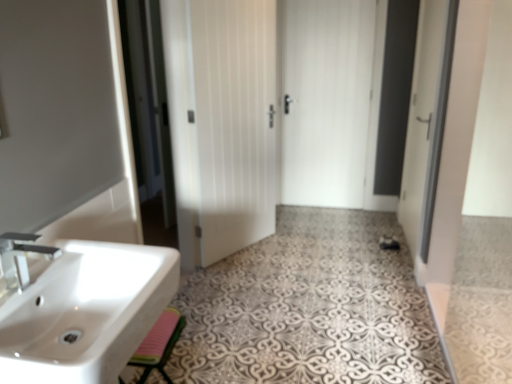
Question: From a real-world perspective, is white matte door at center, which is the second door from right to left, physically below matte silver faucet at left?

Choices:
 (A) no
 (B) yes

Answer: (B)

Question: Is white matte door at center, which is the second door from right to left, positioned beyond the bounds of matte silver faucet at left?

Choices:
 (A) yes
 (B) no

Answer: (A)

Question: Does white matte door at center, which is the second door from right to left, have a larger size compared to matte silver faucet at left?

Choices:
 (A) yes
 (B) no

Answer: (A)

Question: Is white matte door at center, positioned as the 1th door in left-to-right order, directly adjacent to matte silver faucet at left?

Choices:
 (A) yes
 (B) no

Answer: (B)

Question: From the image's perspective, is white matte door at center, positioned as the 1th door in left-to-right order, on matte silver faucet at left?

Choices:
 (A) no
 (B) yes

Answer: (B)

Question: In the image, is white matte door at center, marked as the first door in a front-to-back arrangement, positioned in front of or behind pink rubber mat at lower left?

Choices:
 (A) front
 (B) behind

Answer: (B)

Question: From their relative heights in the image, would you say white matte door at center, which is the second door from right to left, is taller or shorter than pink rubber mat at lower left?

Choices:
 (A) tall
 (B) short

Answer: (A)

Question: Would you say white matte door at center, positioned as the 1th door in left-to-right order, is inside or outside pink rubber mat at lower left?

Choices:
 (A) inside
 (B) outside

Answer: (B)

Question: Is white matte door at center, positioned as the 1th door in left-to-right order, bigger or smaller than pink rubber mat at lower left?

Choices:
 (A) big
 (B) small

Answer: (A)

Question: Considering the positions of white glossy towel at lower left and white glossy sink at lower left in the image, is white glossy towel at lower left taller or shorter than white glossy sink at lower left?

Choices:
 (A) tall
 (B) short

Answer: (B)

Question: Is point (300, 299) closer or farther from the camera than point (89, 370)?

Choices:
 (A) closer
 (B) farther

Answer: (B)

Question: Visually, is white glossy towel at lower left positioned to the left or to the right of white glossy sink at lower left?

Choices:
 (A) right
 (B) left

Answer: (A)

Question: Looking at their shapes, would you say white glossy towel at lower left is wider or thinner than white glossy sink at lower left?

Choices:
 (A) thin
 (B) wide

Answer: (B)

Question: Based on their sizes in the image, would you say matte silver faucet at left is bigger or smaller than pink rubber mat at lower left?

Choices:
 (A) big
 (B) small

Answer: (B)

Question: Is point (3, 271) positioned closer to the camera than point (145, 344)?

Choices:
 (A) farther
 (B) closer

Answer: (B)